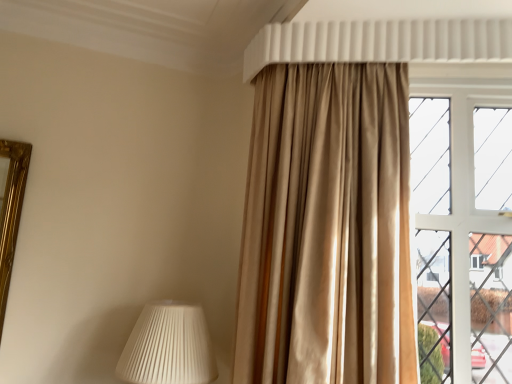
What do you see at coordinates (464, 221) in the screenshot?
I see `white glass window at right` at bounding box center [464, 221].

At what (x,y) coordinates should I click in order to perform the action: click on white pleated lampshade at lower left. Please return your answer as a coordinate pair (x, y). Image resolution: width=512 pixels, height=384 pixels. Looking at the image, I should click on (x=168, y=347).

From a real-world perspective, between satin beige curtain at upper right and white pleated lampshade at lower left, who is vertically lower?

From a 3D spatial view, white pleated lampshade at lower left is below.

Considering the sizes of objects satin beige curtain at upper right and white pleated lampshade at lower left in the image provided, who is bigger, satin beige curtain at upper right or white pleated lampshade at lower left?

satin beige curtain at upper right.

In the scene shown: Can you see satin beige curtain at upper right touching white pleated lampshade at lower left?

No, satin beige curtain at upper right is not touching white pleated lampshade at lower left.

Measure the distance between satin beige curtain at upper right and white pleated lampshade at lower left.

The distance of satin beige curtain at upper right from white pleated lampshade at lower left is 19.40 inches.

From the image's perspective, which object appears higher, white pleated lampshade at lower left or satin beige curtain at upper right?

satin beige curtain at upper right, from the image's perspective.

Would you say white pleated lampshade at lower left is inside or outside satin beige curtain at upper right?

The correct answer is: outside.

This screenshot has height=384, width=512. I want to click on table lamp below the satin beige curtain at upper right (from the image's perspective), so click(x=168, y=347).

Is white pleated lampshade at lower left far from satin beige curtain at upper right?

white pleated lampshade at lower left is actually quite close to satin beige curtain at upper right.

Does point (317, 73) come in front of point (505, 54)?

No, (317, 73) is further to viewer.

Considering the positions of objects satin beige curtain at upper right and white plastic shutter at upper center in the image provided, who is in front, satin beige curtain at upper right or white plastic shutter at upper center?

satin beige curtain at upper right is in front.

In terms of size, does satin beige curtain at upper right appear bigger or smaller than white plastic shutter at upper center?

Clearly, satin beige curtain at upper right is larger in size than white plastic shutter at upper center.

Based on the photo, is white glass window at right closer to camera compared to white pleated lampshade at lower left?

No, white glass window at right is behind white pleated lampshade at lower left.

I want to click on table lamp that is in front of the white glass window at right, so click(168, 347).

From a real-world perspective, between white glass window at right and white pleated lampshade at lower left, who is vertically higher?

From a 3D spatial view, white glass window at right is above.

Is point (467, 271) closer to camera compared to point (440, 33)?

No.

From the image's perspective, which is below, white glass window at right or white plastic shutter at upper center?

From the image's view, white glass window at right is below.

Consider the image. Is white glass window at right inside the boundaries of white plastic shutter at upper center, or outside?

white glass window at right cannot be found inside white plastic shutter at upper center.

Which object is further away from the camera, white pleated lampshade at lower left or white glass window at right?

white glass window at right.

Looking at this image, what's the angular difference between white pleated lampshade at lower left and white glass window at right's facing directions?

The angular difference between white pleated lampshade at lower left and white glass window at right is 3.25 degrees.

Is white pleated lampshade at lower left turned away from white glass window at right?

No, white glass window at right is not at the back of white pleated lampshade at lower left.

Would you say white pleated lampshade at lower left is a long distance from white glass window at right?

white pleated lampshade at lower left is far away from white glass window at right.

From the picture: Which point is more distant from viewer, [376,51] or [251,343]?

The point [376,51] is farther.

How much distance is there between white plastic shutter at upper center and satin beige curtain at upper right?

white plastic shutter at upper center is 20.97 inches away from satin beige curtain at upper right.

Can you tell me how much white plastic shutter at upper center and satin beige curtain at upper right differ in facing direction?

The facing directions of white plastic shutter at upper center and satin beige curtain at upper right are 3.62 degrees apart.

Is white plastic shutter at upper center further to the viewer compared to satin beige curtain at upper right?

Yes.

Image resolution: width=512 pixels, height=384 pixels. What are the coordinates of `curtain in front of the white pleated lampshade at lower left` in the screenshot? It's located at (327, 228).

Locate an element on the screen. The width and height of the screenshot is (512, 384). curtain that appears on the right of white pleated lampshade at lower left is located at coordinates pos(327,228).

Estimate the real-world distances between objects in this image. Which object is further from white glass window at right, white pleated lampshade at lower left or satin beige curtain at upper right?

white pleated lampshade at lower left is further to white glass window at right.

Based on the photo, from the image, which object appears to be farther from white plastic shutter at upper center, satin beige curtain at upper right or white glass window at right?

Based on the image, white glass window at right appears to be further to white plastic shutter at upper center.

Considering their positions, is white pleated lampshade at lower left positioned further to white plastic shutter at upper center than white glass window at right?

white pleated lampshade at lower left lies further to white plastic shutter at upper center than the other object.

Considering their positions, is white plastic shutter at upper center positioned further to white glass window at right than white pleated lampshade at lower left?

white pleated lampshade at lower left lies further to white glass window at right than the other object.

Which object lies further to the anchor point satin beige curtain at upper right, white pleated lampshade at lower left or white glass window at right?

Among the two, white pleated lampshade at lower left is located further to satin beige curtain at upper right.

Considering their positions, is satin beige curtain at upper right positioned closer to white plastic shutter at upper center than white pleated lampshade at lower left?

satin beige curtain at upper right lies closer to white plastic shutter at upper center than the other object.

Estimate the real-world distances between objects in this image. Which object is further from white plastic shutter at upper center, white pleated lampshade at lower left or satin beige curtain at upper right?

Among the two, white pleated lampshade at lower left is located further to white plastic shutter at upper center.

Estimate the real-world distances between objects in this image. Which object is closer to white pleated lampshade at lower left, white glass window at right or satin beige curtain at upper right?

satin beige curtain at upper right.

Where is `curtain between white plastic shutter at upper center and white glass window at right vertically`? curtain between white plastic shutter at upper center and white glass window at right vertically is located at coordinates (327, 228).

Identify the location of curtain between white pleated lampshade at lower left and white glass window at right. (x=327, y=228).

This screenshot has height=384, width=512. Identify the location of shutter located between white pleated lampshade at lower left and white glass window at right in the left-right direction. (388, 45).

Find the location of a particular element. This screenshot has height=384, width=512. curtain between white plastic shutter at upper center and white pleated lampshade at lower left from top to bottom is located at coordinates (327, 228).